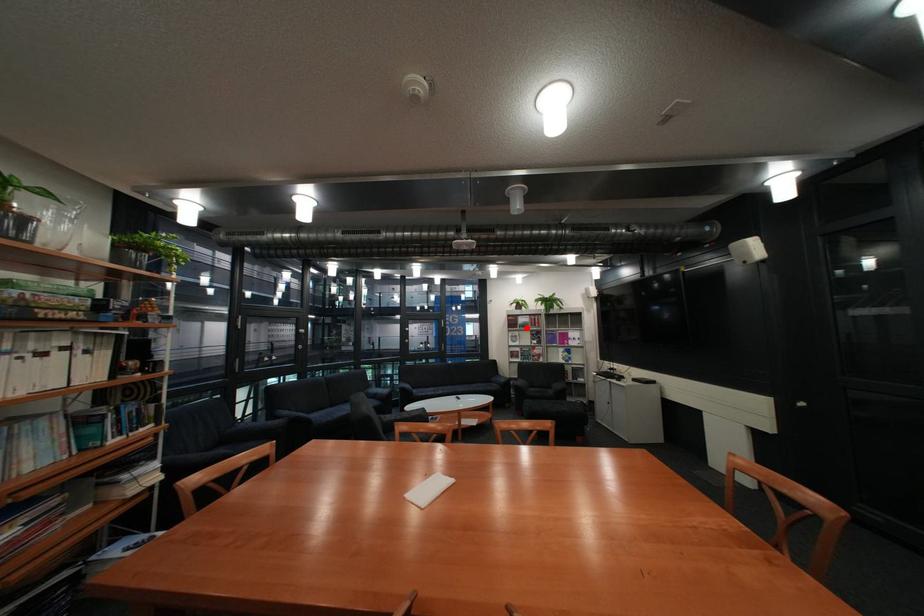
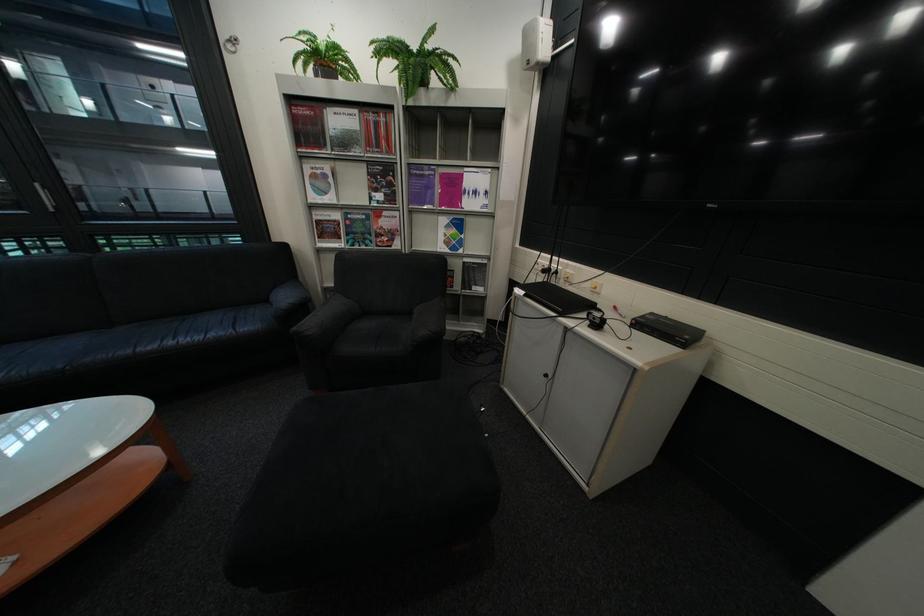
Where in the second image is the point corresponding to the highlighted location from the first image?

(322, 147)